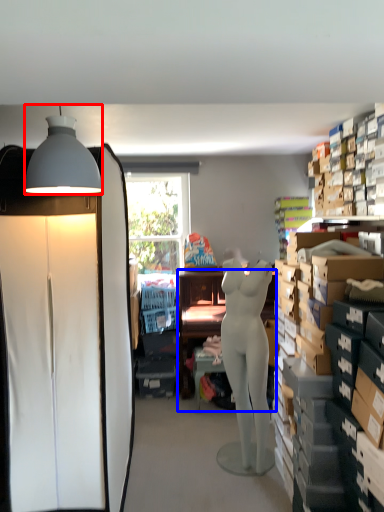
Question: Which object is further to the camera taking this photo, lamp (highlighted by a red box) or desk (highlighted by a blue box)?

Choices:
 (A) lamp
 (B) desk

Answer: (B)